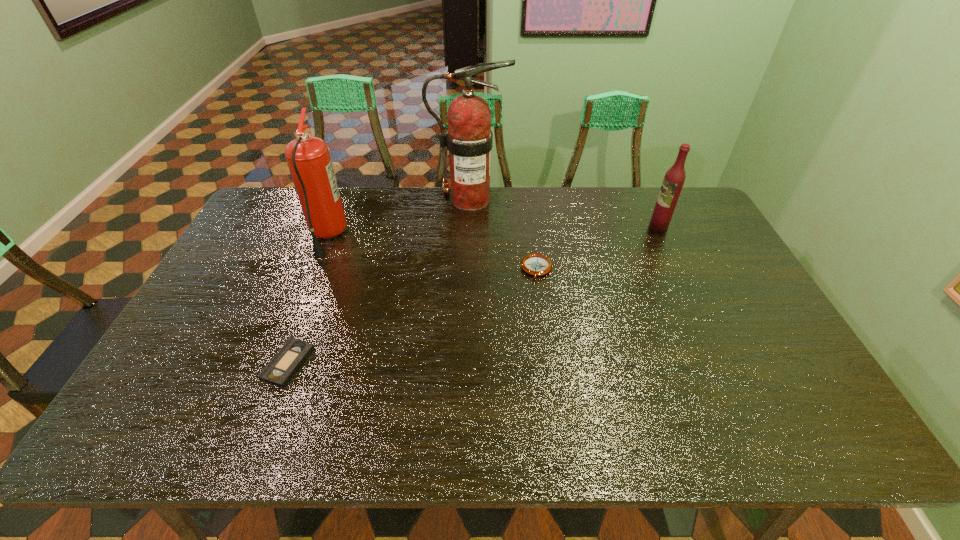
This screenshot has height=540, width=960. In order to click on free space at the far edge in this screenshot , I will do `click(360, 197)`.

Locate an element on the screen. free space at the near edge of the desktop is located at coordinates [422, 423].

This screenshot has height=540, width=960. I want to click on vacant region at the left edge of the desktop, so click(x=210, y=330).

Locate an element on the screen. free location at the right edge is located at coordinates (704, 287).

The image size is (960, 540). What are the coordinates of `free space at the far left corner of the desktop` in the screenshot? It's located at (283, 207).

I want to click on vacant space at the far right corner, so click(x=687, y=205).

Locate an element on the screen. The image size is (960, 540). vacant area between the shorter fire extinguisher and the taller fire extinguisher is located at coordinates (398, 218).

Where is `free space between the left fire extinguisher and the tallest object`? free space between the left fire extinguisher and the tallest object is located at coordinates (398, 218).

Where is `unoccupied position between the rightmost object and the taller fire extinguisher`? The height and width of the screenshot is (540, 960). unoccupied position between the rightmost object and the taller fire extinguisher is located at coordinates (564, 213).

Locate an element on the screen. The image size is (960, 540). vacant area that lies between the liquor and the compass is located at coordinates (597, 248).